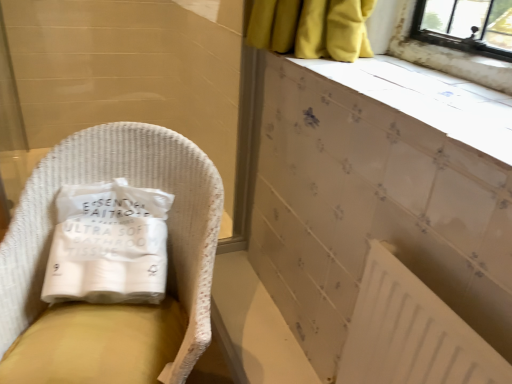
Question: Considering the relative sizes of white textured ledge at upper right and white paper towel at left in the image provided, is white textured ledge at upper right shorter than white paper towel at left?

Choices:
 (A) no
 (B) yes

Answer: (B)

Question: Would you say white textured ledge at upper right is outside white paper towel at left?

Choices:
 (A) no
 (B) yes

Answer: (B)

Question: Considering the relative sizes of white textured ledge at upper right and white paper towel at left in the image provided, is white textured ledge at upper right taller than white paper towel at left?

Choices:
 (A) yes
 (B) no

Answer: (B)

Question: Does white textured ledge at upper right have a lesser width compared to white paper towel at left?

Choices:
 (A) yes
 (B) no

Answer: (B)

Question: Does white textured ledge at upper right lie in front of white paper towel at left?

Choices:
 (A) no
 (B) yes

Answer: (B)

Question: In terms of width, does white paper towel at left look wider or thinner when compared to white matte radiator at lower right?

Choices:
 (A) wide
 (B) thin

Answer: (A)

Question: Is white paper towel at left to the left or to the right of white matte radiator at lower right in the image?

Choices:
 (A) right
 (B) left

Answer: (B)

Question: Is point (122, 269) positioned closer to the camera than point (372, 370)?

Choices:
 (A) closer
 (B) farther

Answer: (B)

Question: In terms of size, does white paper towel at left appear bigger or smaller than white matte radiator at lower right?

Choices:
 (A) big
 (B) small

Answer: (A)

Question: Is white paper towel at left taller or shorter than white wicker chair at left?

Choices:
 (A) tall
 (B) short

Answer: (B)

Question: In terms of size, does white paper towel at left appear bigger or smaller than white wicker chair at left?

Choices:
 (A) big
 (B) small

Answer: (B)

Question: Is white paper towel at left to the left or to the right of white wicker chair at left in the image?

Choices:
 (A) right
 (B) left

Answer: (B)

Question: From the image's perspective, is white paper towel at left located above or below white wicker chair at left?

Choices:
 (A) below
 (B) above

Answer: (B)

Question: Based on their sizes in the image, would you say white paper towel at left is bigger or smaller than white textured ledge at upper right?

Choices:
 (A) small
 (B) big

Answer: (B)

Question: Is white paper towel at left in front of or behind white textured ledge at upper right in the image?

Choices:
 (A) behind
 (B) front

Answer: (A)